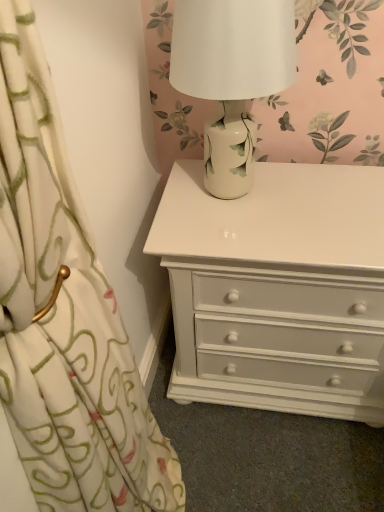
Question: Is white glossy chest of drawers at center not inside white ceramic lamp at upper center?

Choices:
 (A) no
 (B) yes

Answer: (B)

Question: Is white glossy chest of drawers at center turned away from white ceramic lamp at upper center?

Choices:
 (A) no
 (B) yes

Answer: (A)

Question: Can you confirm if white glossy chest of drawers at center is positioned to the left of white ceramic lamp at upper center?

Choices:
 (A) yes
 (B) no

Answer: (B)

Question: Is white glossy chest of drawers at center touching white ceramic lamp at upper center?

Choices:
 (A) yes
 (B) no

Answer: (B)

Question: Is white ceramic lamp at upper center a part of white glossy chest of drawers at center?

Choices:
 (A) no
 (B) yes

Answer: (A)

Question: Does white glossy chest of drawers at center come behind white ceramic lamp at upper center?

Choices:
 (A) yes
 (B) no

Answer: (A)

Question: From a real-world perspective, is white ceramic lamp at upper center physically below white glossy chest of drawers at center?

Choices:
 (A) yes
 (B) no

Answer: (B)

Question: Is white ceramic lamp at upper center at the right side of white glossy chest of drawers at center?

Choices:
 (A) no
 (B) yes

Answer: (A)

Question: Is white ceramic lamp at upper center further to camera compared to white glossy chest of drawers at center?

Choices:
 (A) yes
 (B) no

Answer: (B)

Question: Considering the relative sizes of white ceramic lamp at upper center and white glossy chest of drawers at center in the image provided, is white ceramic lamp at upper center thinner than white glossy chest of drawers at center?

Choices:
 (A) yes
 (B) no

Answer: (A)

Question: Is white ceramic lamp at upper center positioned in front of white glossy chest of drawers at center?

Choices:
 (A) yes
 (B) no

Answer: (A)

Question: Is white ceramic lamp at upper center completely or partially outside of white glossy chest of drawers at center?

Choices:
 (A) no
 (B) yes

Answer: (B)

Question: Does point tap(276, 297) appear closer or farther from the camera than point tap(195, 87)?

Choices:
 (A) closer
 (B) farther

Answer: (B)